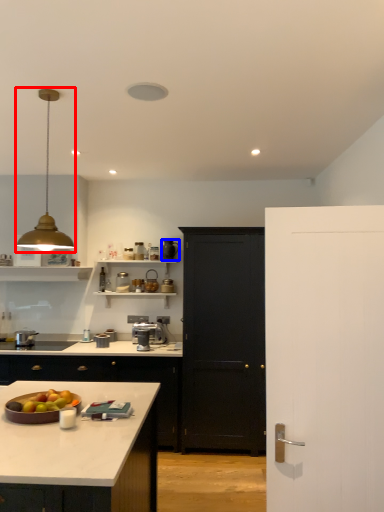
Question: Among these objects, which one is farthest to the camera, light fixture (highlighted by a red box) or appliance (highlighted by a blue box)?

Choices:
 (A) light fixture
 (B) appliance

Answer: (B)